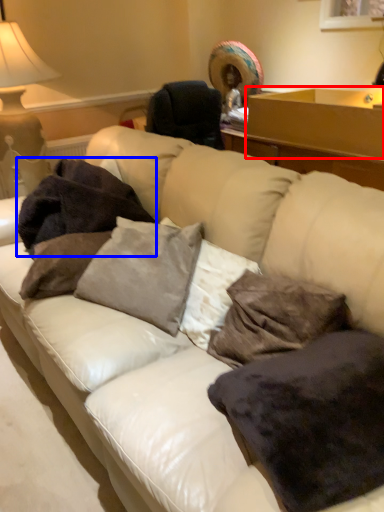
Question: Among these objects, which one is farthest to the camera, table (highlighted by a red box) or blanket (highlighted by a blue box)?

Choices:
 (A) table
 (B) blanket

Answer: (A)